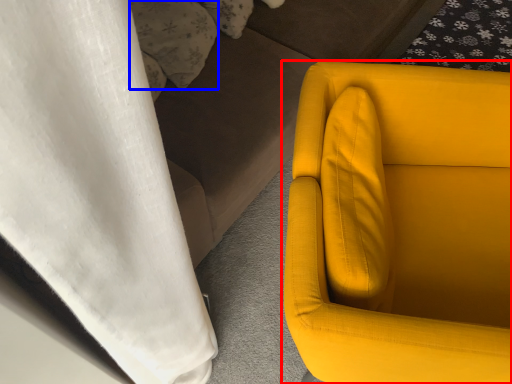
Question: Which of the following is the farthest to the observer, chair (highlighted by a red box) or pillow (highlighted by a blue box)?

Choices:
 (A) chair
 (B) pillow

Answer: (B)